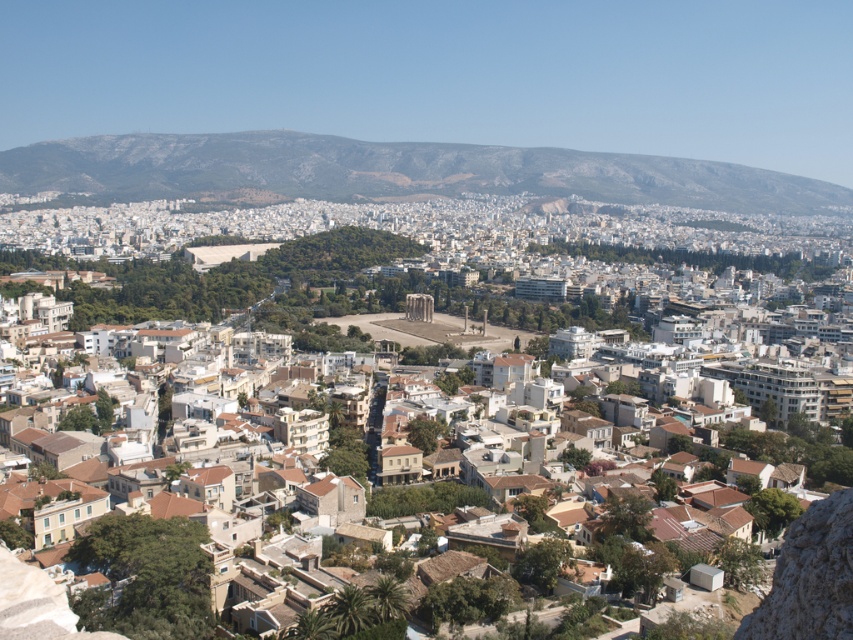
Question: Can you confirm if white stone buildings at center is positioned above gray rocky mountain at upper center?

Choices:
 (A) no
 (B) yes

Answer: (A)

Question: Which object appears farthest from the camera in this image?

Choices:
 (A) gray rocky mountain at upper center
 (B) white stone buildings at center

Answer: (A)

Question: Which of the following is the closest to the observer?

Choices:
 (A) white stone buildings at center
 (B) gray rocky mountain at upper center

Answer: (A)

Question: Can you confirm if white stone buildings at center is bigger than gray rocky mountain at upper center?

Choices:
 (A) no
 (B) yes

Answer: (B)

Question: Is white stone buildings at center further to the viewer compared to gray rocky mountain at upper center?

Choices:
 (A) no
 (B) yes

Answer: (A)